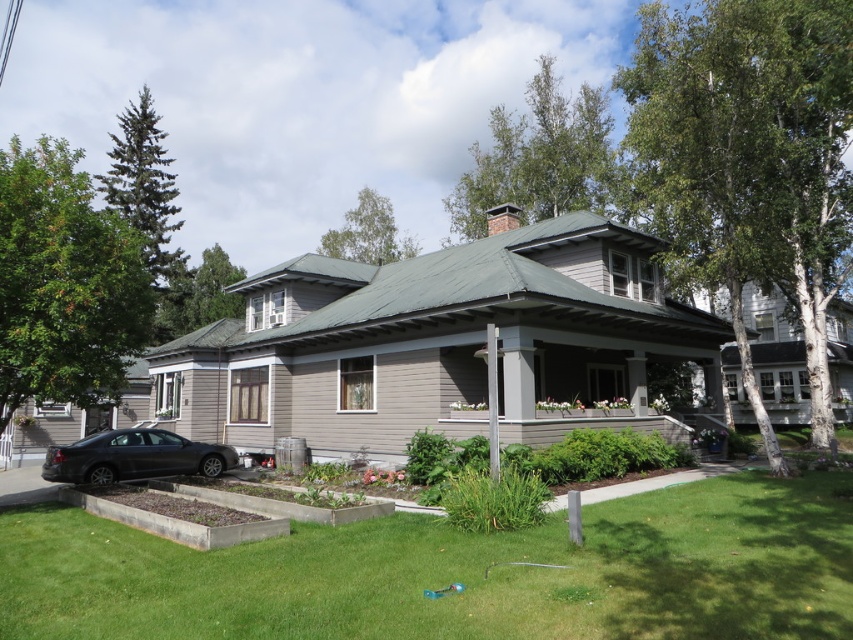
Question: Can you confirm if green grass at lower center is thinner than matte black car at lower left?

Choices:
 (A) yes
 (B) no

Answer: (B)

Question: Is green grass at lower center to the right of matte black car at lower left from the viewer's perspective?

Choices:
 (A) no
 (B) yes

Answer: (B)

Question: Which object appears closest to the camera in this image?

Choices:
 (A) matte black car at lower left
 (B) green grass at lower center

Answer: (B)

Question: Does green grass at lower center appear on the right side of matte black car at lower left?

Choices:
 (A) no
 (B) yes

Answer: (B)

Question: Which point is farther from the camera taking this photo?

Choices:
 (A) (173, 461)
 (B) (329, 572)

Answer: (A)